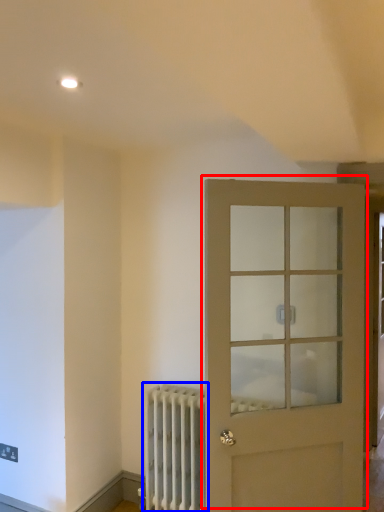
Question: Which object appears closest to the camera in this image, door (highlighted by a red box) or radiator (highlighted by a blue box)?

Choices:
 (A) door
 (B) radiator

Answer: (A)